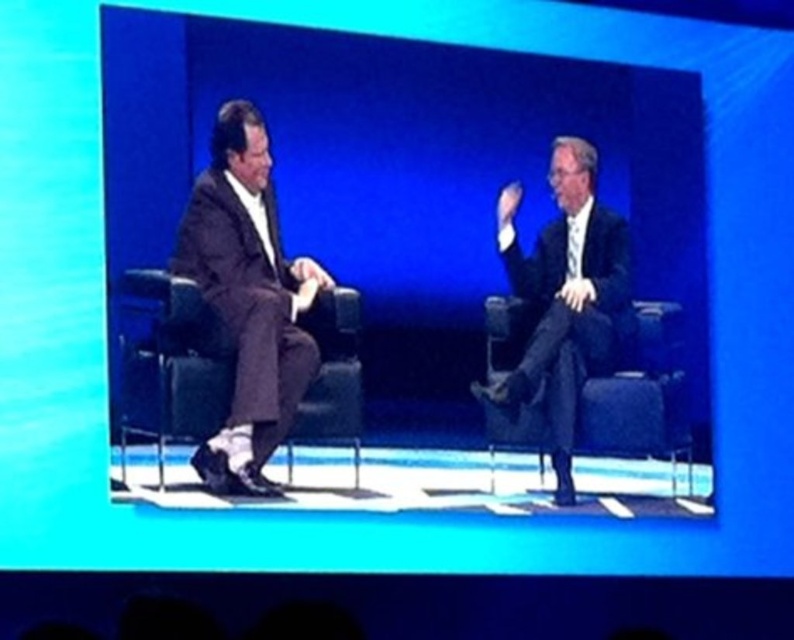
You are an event planner trying to place a small microphone stand between the two individuals on stage. The coordinates for the dark brown suit at left are given as point (249,300). Where should you place the microphone stand so it is equidistant from both individuals?

The point (249,300) corresponds to the dark brown suit at left. To place the microphone stand equidistant from both individuals, it should be positioned at the midpoint between the two people, which would be halfway between the coordinates of the dark brown suit at left and the other individual on the right.

You are an event organizer trying to set up a microphone for the person in the dark brown suit at left. Based on their position, where should you place the microphone stand in relation to their current location?

The dark brown suit at left is located at point (249,300). You should place the microphone stand slightly to the right of their current position to allow for natural hand gestures during the discussion.